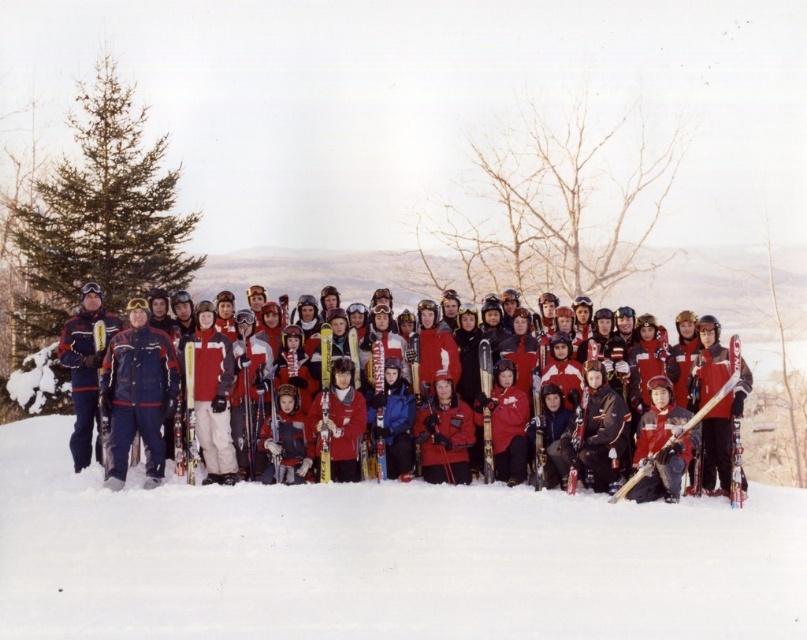
Question: Which point is farther from the camera taking this photo?

Choices:
 (A) (257, 564)
 (B) (153, 371)

Answer: (B)

Question: Considering the relative positions of matte red skis at center and matte red jacket at center in the image provided, where is matte red skis at center located with respect to matte red jacket at center?

Choices:
 (A) below
 (B) above

Answer: (A)

Question: Is matte red skis at center bigger than matte red jacket at center?

Choices:
 (A) no
 (B) yes

Answer: (A)

Question: Which object is closer to the camera taking this photo?

Choices:
 (A) matte red jacket at center
 (B) matte red skis at center

Answer: (B)

Question: Can you confirm if matte red skis at center is positioned to the left of matte red jacket at center?

Choices:
 (A) no
 (B) yes

Answer: (A)